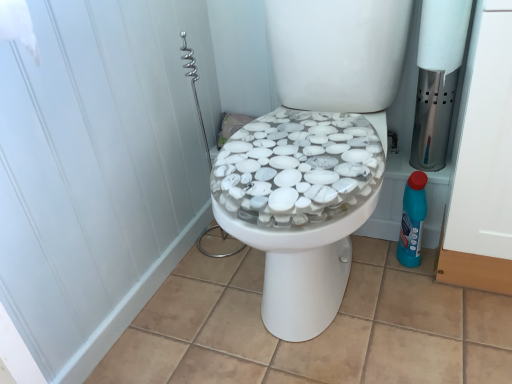
Question: Could white matte screen door at upper left be considered to be inside white matte toilet paper at upper right?

Choices:
 (A) yes
 (B) no

Answer: (B)

Question: Is white matte toilet paper at upper right placed right next to white matte screen door at upper left?

Choices:
 (A) no
 (B) yes

Answer: (A)

Question: Does white matte toilet paper at upper right have a larger size compared to white matte screen door at upper left?

Choices:
 (A) yes
 (B) no

Answer: (B)

Question: Is white matte toilet paper at upper right aimed at white matte screen door at upper left?

Choices:
 (A) yes
 (B) no

Answer: (B)

Question: Does white matte toilet paper at upper right appear on the left side of white matte screen door at upper left?

Choices:
 (A) yes
 (B) no

Answer: (B)

Question: Is white matte toilet paper at upper right looking in the opposite direction of white matte screen door at upper left?

Choices:
 (A) no
 (B) yes

Answer: (A)

Question: Does white matte screen door at upper left come in front of white matte toilet paper at upper right?

Choices:
 (A) yes
 (B) no

Answer: (A)

Question: Does white matte screen door at upper left come behind white matte toilet paper at upper right?

Choices:
 (A) no
 (B) yes

Answer: (A)

Question: Does white matte screen door at upper left appear on the right side of white matte toilet paper at upper right?

Choices:
 (A) no
 (B) yes

Answer: (A)

Question: From the image's perspective, is white matte screen door at upper left located above white matte toilet paper at upper right?

Choices:
 (A) yes
 (B) no

Answer: (B)

Question: Does white matte screen door at upper left contain white matte toilet paper at upper right?

Choices:
 (A) yes
 (B) no

Answer: (B)

Question: Does white matte screen door at upper left have a greater height compared to white matte toilet paper at upper right?

Choices:
 (A) no
 (B) yes

Answer: (B)

Question: From the image's perspective, does blue plastic bottle at right appear lower than white matte toilet paper at upper right?

Choices:
 (A) no
 (B) yes

Answer: (B)